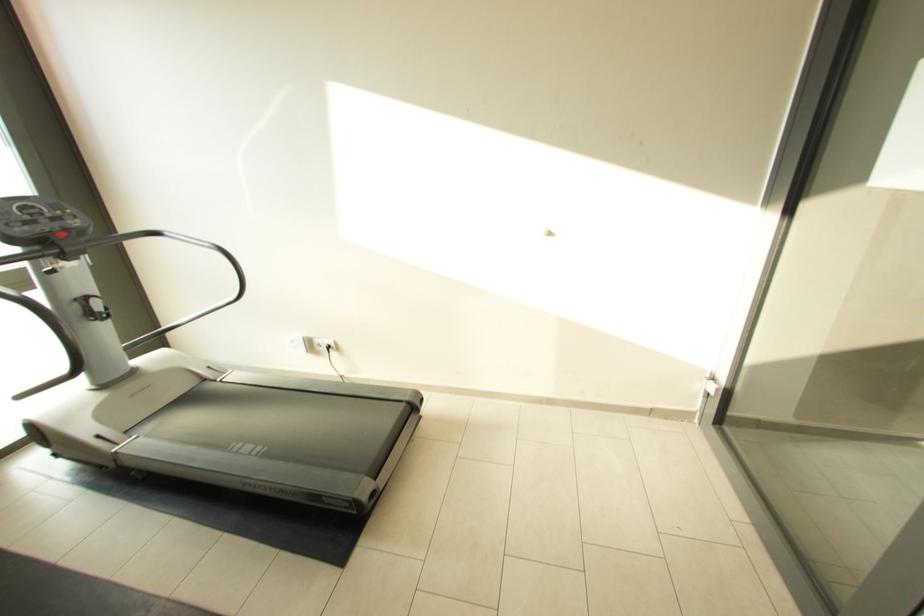
Where would you press the red treadmill button? Please return your answer as a coordinate pair (x, y).

(58, 235)